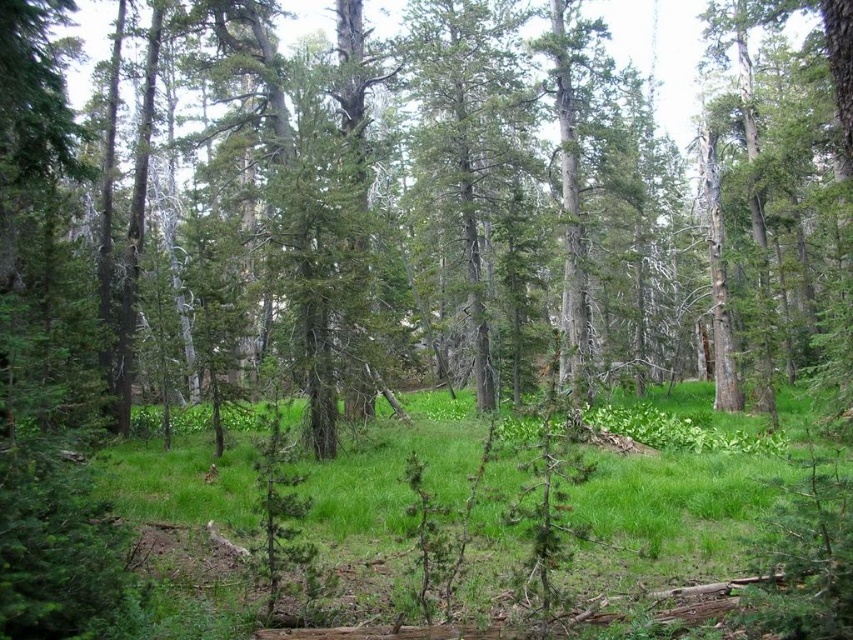
You are standing in the forest and see both the green leafy tree at center and the green grassy area at center. Which one is closer to you?

The green leafy tree at center is closer to you since it is in front of the green grassy area at center.